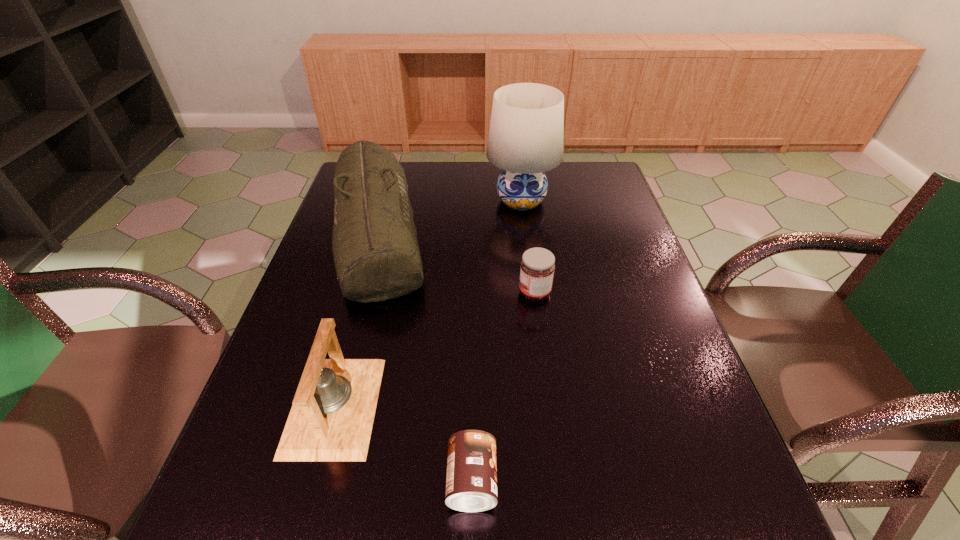
At what (x,y) coordinates should I click in order to perform the action: click on free spot between the bell and the shortest object. Please return your answer as a coordinate pair (x, y). Looking at the image, I should click on (403, 443).

Where is `unoccupied position between the lampshade and the bell`? The image size is (960, 540). unoccupied position between the lampshade and the bell is located at coordinates (428, 303).

The height and width of the screenshot is (540, 960). In order to click on free spot between the lampshade and the third tallest object in this screenshot , I will do `click(428, 303)`.

Where is `free space between the can and the duffel bag`? The width and height of the screenshot is (960, 540). free space between the can and the duffel bag is located at coordinates (424, 357).

Locate an element on the screen. The height and width of the screenshot is (540, 960). free point between the fourth tallest object and the can is located at coordinates (503, 387).

The width and height of the screenshot is (960, 540). What are the coordinates of `free space between the duffel bag and the can` in the screenshot? It's located at (424, 357).

This screenshot has width=960, height=540. Find the location of `empty space between the tallest object and the shortest object`. empty space between the tallest object and the shortest object is located at coordinates (496, 341).

At what (x,y) coordinates should I click in order to perform the action: click on vacant area that lies between the duffel bag and the tallest object. Please return your answer as a coordinate pair (x, y). The width and height of the screenshot is (960, 540). Looking at the image, I should click on (449, 217).

The width and height of the screenshot is (960, 540). What are the coordinates of `free spot between the third tallest object and the tallest object` in the screenshot? It's located at (428, 303).

Where is `vacant region between the duffel bag and the shortest object`? vacant region between the duffel bag and the shortest object is located at coordinates (424, 357).